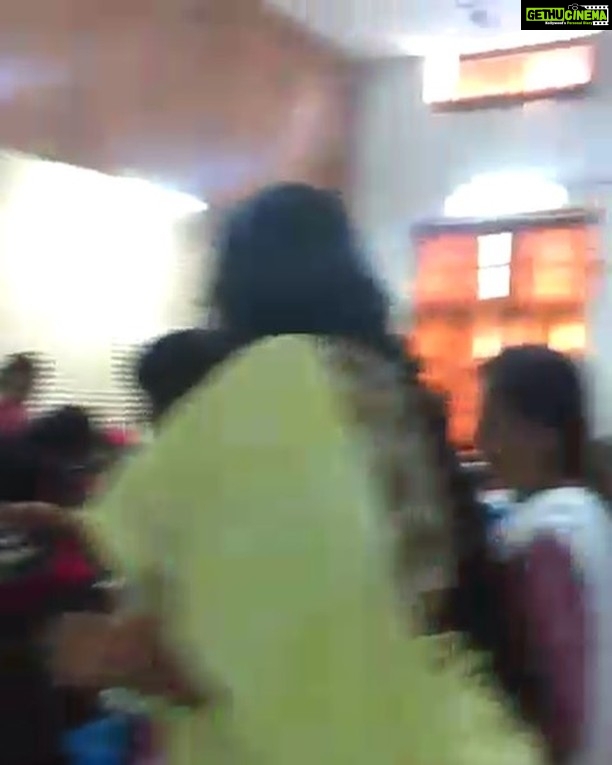
The width and height of the screenshot is (612, 765). What are the coordinates of `window` in the screenshot? It's located at (519, 259), (510, 63), (106, 316).